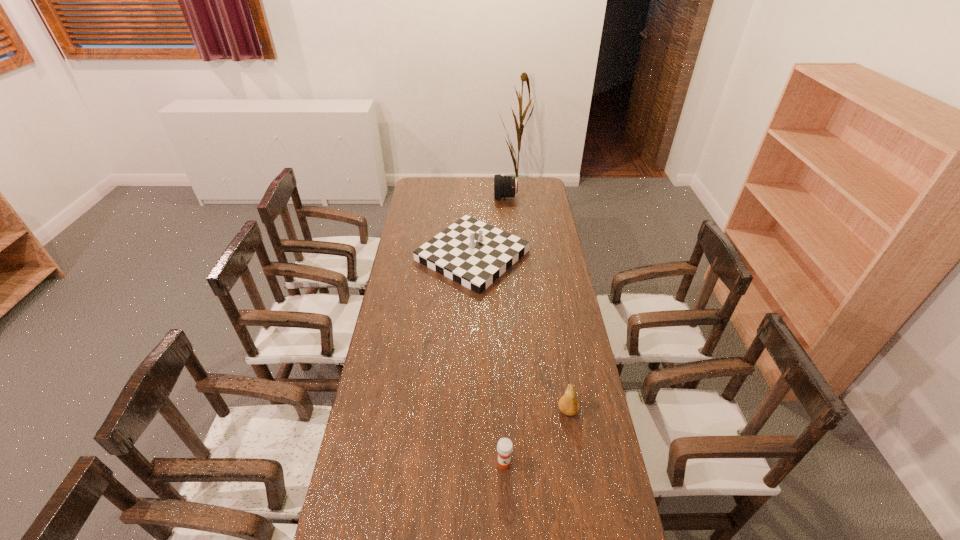
What are the coordinates of `free space between the checkerboard and the nearest object` in the screenshot? It's located at (488, 360).

Identify the location of free spot between the telephoto lens and the nearest object. point(505,330).

You are a GUI agent. You are given a task and a screenshot of the screen. Output one action in this format:
    pyautogui.click(x=<x>, y=<y>)
    Task: Click on the unoccupied position between the second farthest object and the medicine
    This screenshot has height=540, width=960.
    Given the screenshot: What is the action you would take?
    pyautogui.click(x=488, y=360)

Locate an element on the screen. empty space between the medicine and the farthest object is located at coordinates (505, 330).

The height and width of the screenshot is (540, 960). Find the location of `free spot between the checkerboard and the pear`. free spot between the checkerboard and the pear is located at coordinates (520, 333).

Point out which object is positioned as the second nearest to the checkerboard. Please provide its 2D coordinates. Your answer should be formatted as a tuple, i.e. [(x, y)], where the tuple contains the x and y coordinates of a point satisfying the conditions above.

[(568, 404)]

At what (x,y) coordinates should I click in order to perform the action: click on object that is the closest to the telephoto lens. Please return your answer as a coordinate pair (x, y). The image size is (960, 540). Looking at the image, I should click on (470, 252).

Locate an element on the screen. The image size is (960, 540). vacant position in the image that satisfies the following two spatial constraints: 1. at the front element of the rightmost object; 2. on the left side of the farthest object is located at coordinates (x=523, y=410).

Find the location of a particular element. The height and width of the screenshot is (540, 960). free space that satisfies the following two spatial constraints: 1. on the front side of the checkerboard; 2. on the right side of the pear is located at coordinates (469, 410).